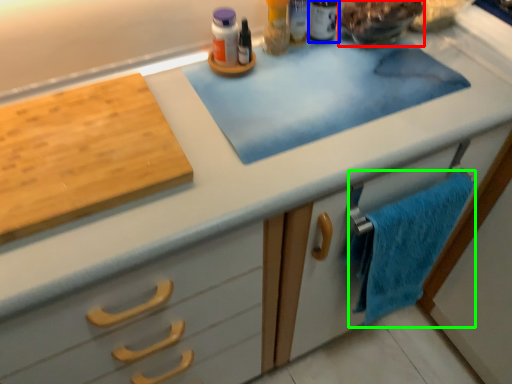
Question: Which object is the closest to the food (highlighted by a red box)? Choose among these: toiletry (highlighted by a blue box) or bath towel (highlighted by a green box).

Choices:
 (A) toiletry
 (B) bath towel

Answer: (A)